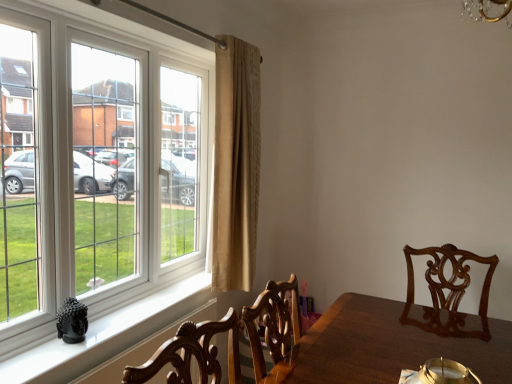
Question: Is white plastic window at left oriented away from beige textured curtain at center?

Choices:
 (A) yes
 (B) no

Answer: (B)

Question: Is white plastic window at left placed right next to beige textured curtain at center?

Choices:
 (A) no
 (B) yes

Answer: (A)

Question: Is white plastic window at left not inside beige textured curtain at center?

Choices:
 (A) no
 (B) yes

Answer: (B)

Question: Is white plastic window at left behind beige textured curtain at center?

Choices:
 (A) yes
 (B) no

Answer: (B)

Question: Considering the relative sizes of white plastic window at left and beige textured curtain at center in the image provided, is white plastic window at left bigger than beige textured curtain at center?

Choices:
 (A) no
 (B) yes

Answer: (B)

Question: From the image's perspective, is white plastic window at left below beige textured curtain at center?

Choices:
 (A) yes
 (B) no

Answer: (A)

Question: Is white plastic window at left not within black glossy buddha statue at lower left?

Choices:
 (A) yes
 (B) no

Answer: (A)

Question: From the image's perspective, does white plastic window at left appear higher than black glossy buddha statue at lower left?

Choices:
 (A) yes
 (B) no

Answer: (A)

Question: From a real-world perspective, is white plastic window at left on black glossy buddha statue at lower left?

Choices:
 (A) yes
 (B) no

Answer: (A)

Question: From the image's perspective, is white plastic window at left beneath black glossy buddha statue at lower left?

Choices:
 (A) yes
 (B) no

Answer: (B)

Question: Is white plastic window at left further to camera compared to black glossy buddha statue at lower left?

Choices:
 (A) no
 (B) yes

Answer: (A)

Question: Can you confirm if white plastic window at left is taller than black glossy buddha statue at lower left?

Choices:
 (A) yes
 (B) no

Answer: (A)

Question: Considering the relative positions of black glossy buddha statue at lower left and beige textured curtain at center in the image provided, is black glossy buddha statue at lower left to the right of beige textured curtain at center from the viewer's perspective?

Choices:
 (A) yes
 (B) no

Answer: (B)